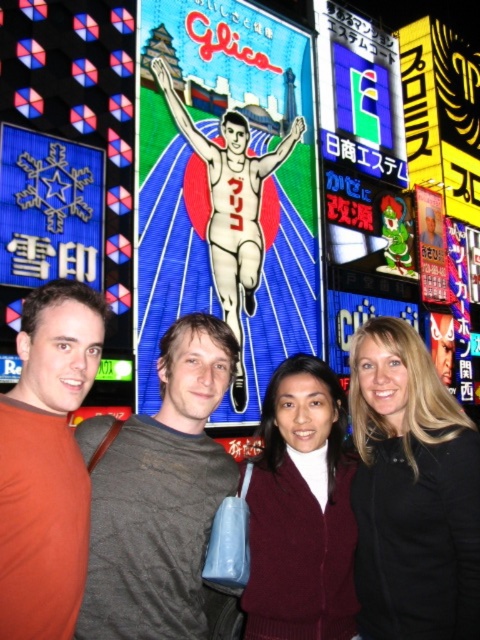
Between gray cotton shirt at center and blue glossy snowflake at upper left, which one has less height?

With less height is blue glossy snowflake at upper left.

Which is below, gray cotton shirt at center or blue glossy snowflake at upper left?

Positioned lower is gray cotton shirt at center.

Who is more distant from viewer, (199, 321) or (96, 188)?

Point (96, 188)

Find the location of a particular element. This screenshot has width=480, height=640. gray cotton shirt at center is located at coordinates (158, 493).

Between colorful digital screen at center and blue glossy snowflake at upper left, which one is positioned higher?

colorful digital screen at center is above.

I want to click on colorful digital screen at center, so [x=226, y=188].

Between point (210, 472) and point (334, 556), which one is positioned behind?

Point (210, 472)

Is gray cotton shirt at center below burgundy sweater at center?

Actually, gray cotton shirt at center is above burgundy sweater at center.

This screenshot has height=640, width=480. What do you see at coordinates (158, 493) in the screenshot? I see `gray cotton shirt at center` at bounding box center [158, 493].

At what (x,y) coordinates should I click in order to perform the action: click on gray cotton shirt at center. Please return your answer as a coordinate pair (x, y). The image size is (480, 640). Looking at the image, I should click on (158, 493).